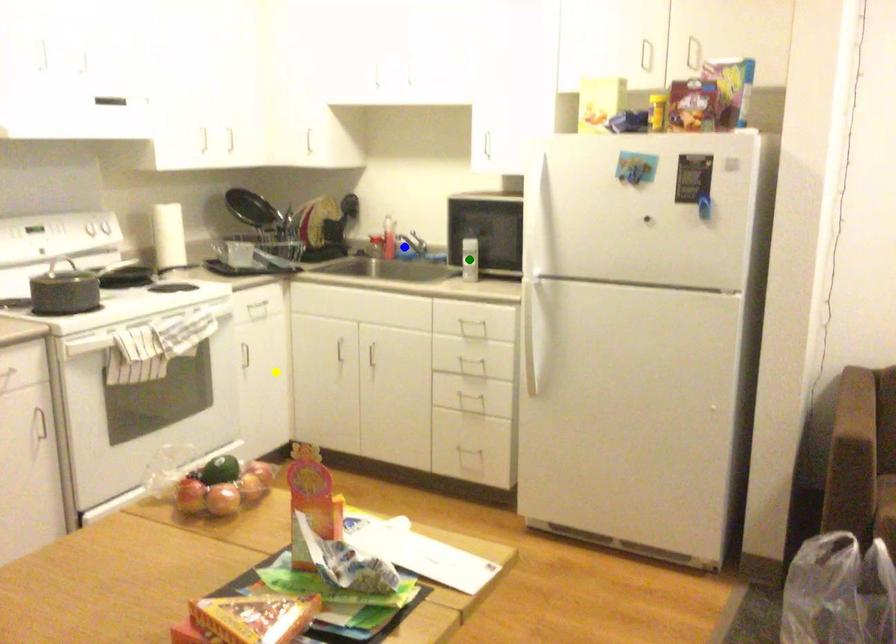
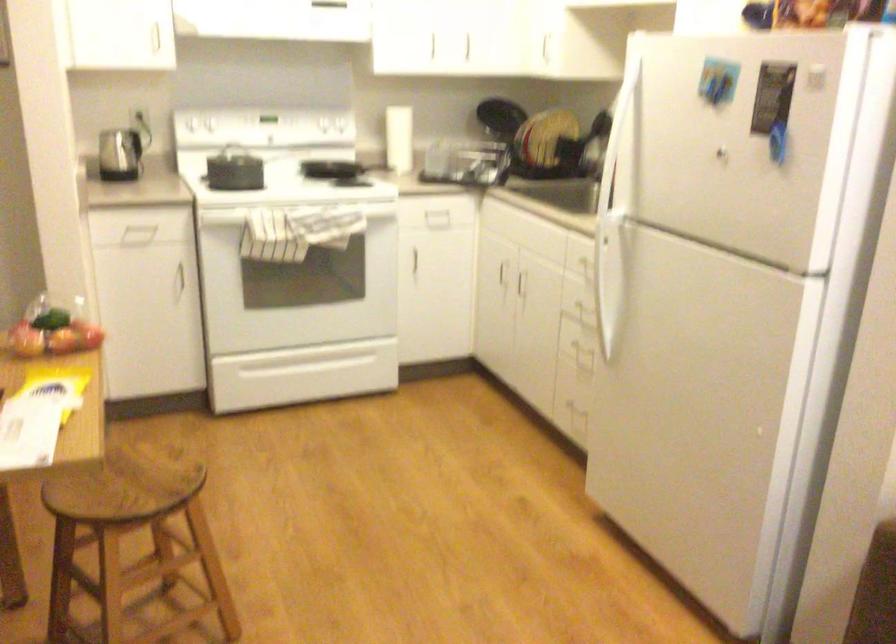
I am providing you with two images of the same scene from different viewpoints. Three points are marked in image1. Which point corresponds to a part or object that is occluded in image2?In image1, three points are marked. Which of them correspond to a part or object that is occluded in image2?Among the three points shown in image1, which one corresponds to a part or object that is no longer visible due to occlusion in image2?

blue point, green point